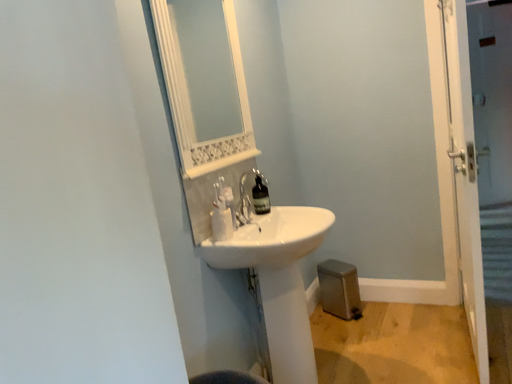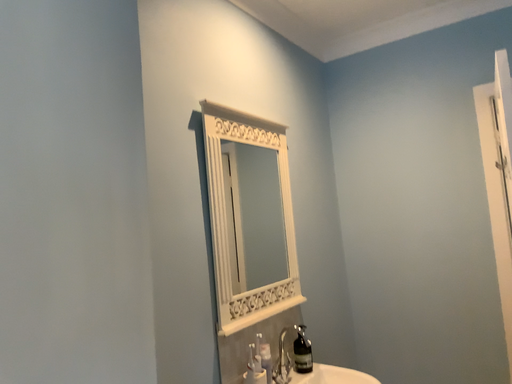
Question: How did the camera likely rotate when shooting the video?

Choices:
 (A) rotated right
 (B) rotated left

Answer: (B)